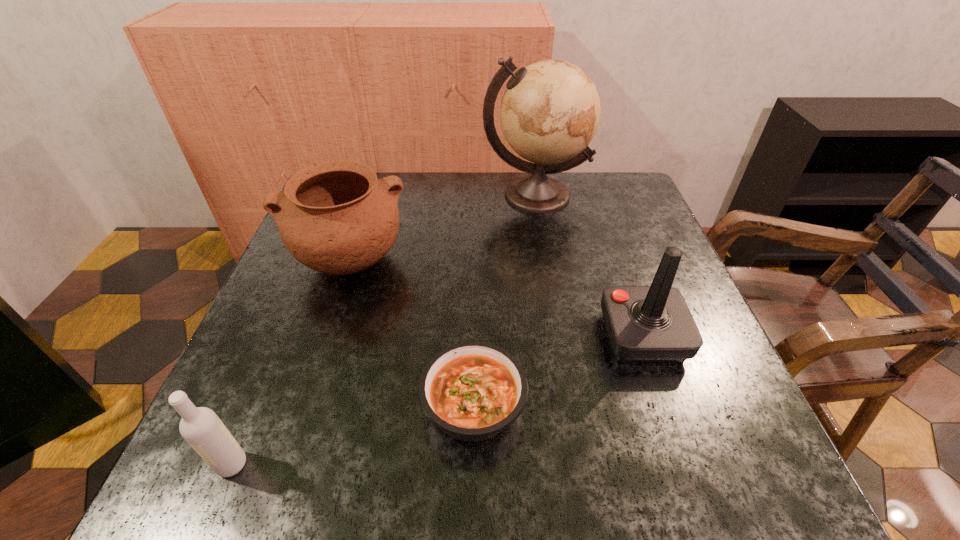
The width and height of the screenshot is (960, 540). I want to click on free location located on the back of the stew, so click(x=475, y=298).

Locate an element on the screen. The height and width of the screenshot is (540, 960). object at the far edge is located at coordinates (550, 111).

The height and width of the screenshot is (540, 960). Find the location of `vodka located at the near edge`. vodka located at the near edge is located at coordinates (201, 427).

This screenshot has width=960, height=540. Find the location of `stew that is at the near edge`. stew that is at the near edge is located at coordinates (472, 390).

Where is `pottery that is at the left edge`? This screenshot has width=960, height=540. pottery that is at the left edge is located at coordinates (335, 217).

I want to click on vodka located at the left edge, so click(201, 427).

Locate an element on the screen. globe at the right edge is located at coordinates (550, 111).

Image resolution: width=960 pixels, height=540 pixels. Find the location of `joystick that is at the right edge`. joystick that is at the right edge is located at coordinates (646, 324).

Where is `object that is at the near left corner`? object that is at the near left corner is located at coordinates (201, 427).

Where is `object that is at the far right corner`? This screenshot has width=960, height=540. object that is at the far right corner is located at coordinates (550, 111).